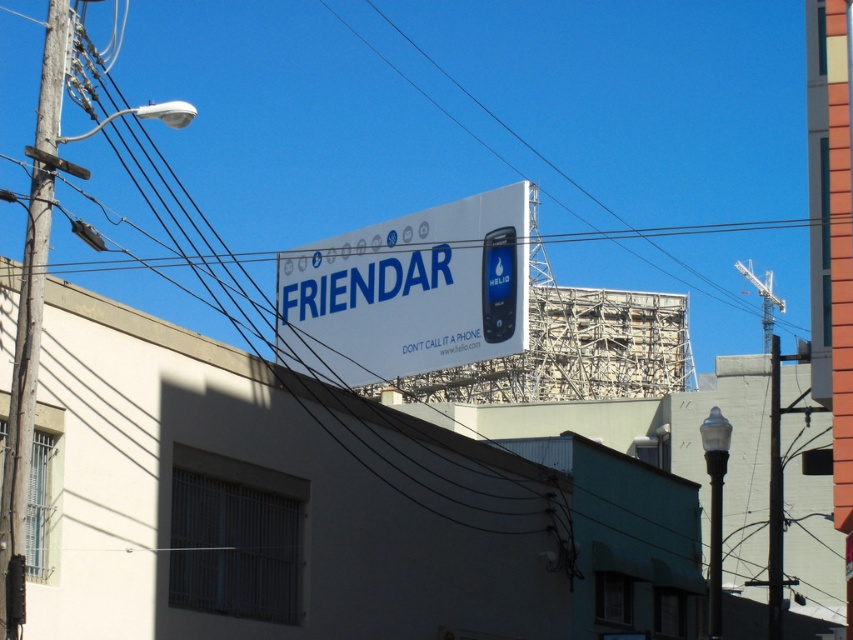
Who is positioned more to the right, white matte signboard at center or wooden utility pole at left?

From the viewer's perspective, white matte signboard at center appears more on the right side.

Does white matte signboard at center have a smaller size compared to wooden utility pole at left?

No.

Is point (401, 333) positioned after point (26, 241)?

Yes, point (401, 333) is farther from viewer.

Identify the location of white matte signboard at center. Image resolution: width=853 pixels, height=640 pixels. (x=408, y=292).

Who is more distant from viewer, (792, 330) or (12, 442)?

Point (792, 330)

Find the location of a particular element. black wire at upper center is located at coordinates (619, 99).

Does black wire at upper center have a smaller size compared to white matte signboard at center?

Actually, black wire at upper center might be larger than white matte signboard at center.

Can you confirm if black wire at upper center is positioned below white matte signboard at center?

Incorrect, black wire at upper center is not positioned below white matte signboard at center.

Describe the element at coordinates (619, 99) in the screenshot. I see `black wire at upper center` at that location.

What are the coordinates of `black wire at upper center` in the screenshot? It's located at (619, 99).